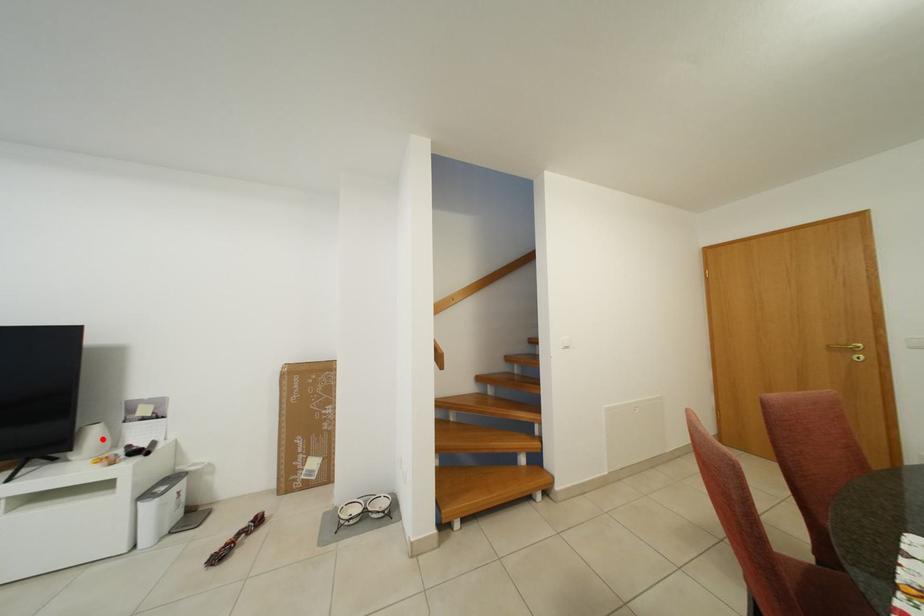
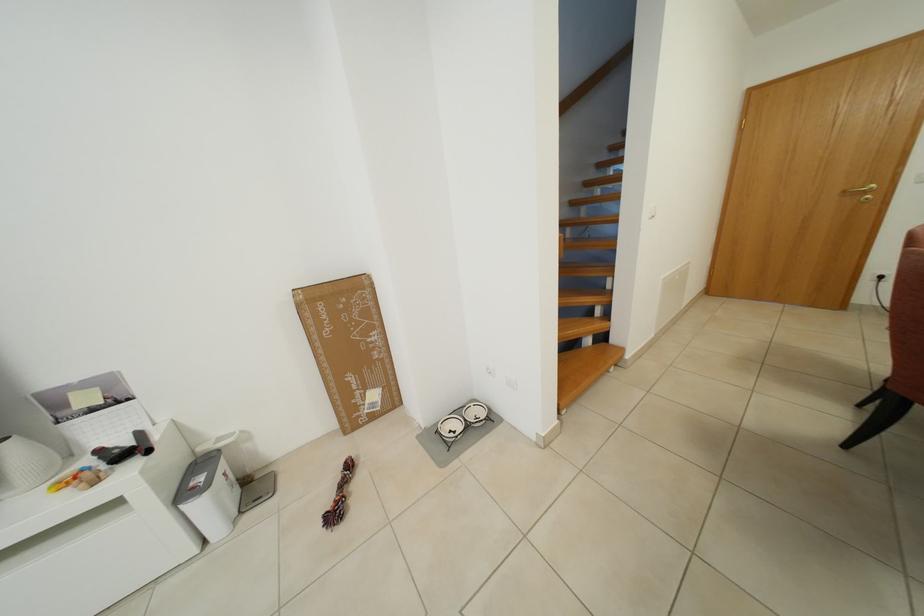
Question: I am providing you with two images of the same scene from different viewpoints. A red point is marked on the first image. At the location where the point appears in image 1, is it still visible in image 2?

Choices:
 (A) Yes
 (B) No

Answer: (A)